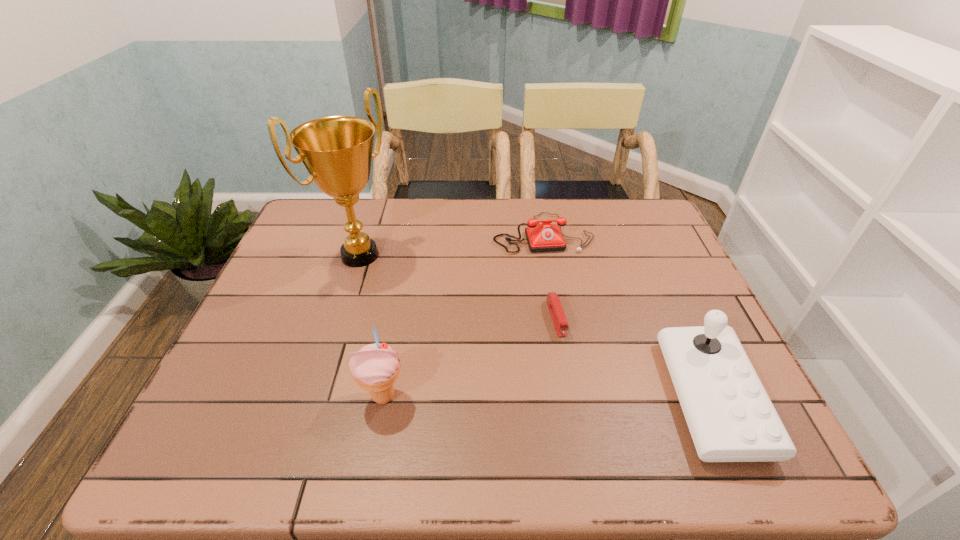
Locate an element on the screen. The image size is (960, 540). free space between the stapler and the tallest object is located at coordinates (458, 287).

Locate which object ranks second in proximity to the shortest object. Please provide its 2D coordinates. Your answer should be formatted as a tuple, i.e. [(x, y)], where the tuple contains the x and y coordinates of a point satisfying the conditions above.

[(730, 416)]

Locate an element on the screen. This screenshot has height=540, width=960. object that can be found as the closest to the third farthest object is located at coordinates (545, 237).

Identify the location of blank area in the image that satisfies the following two spatial constraints: 1. on the back side of the fourth tallest object; 2. on the right side of the tallest object. The height and width of the screenshot is (540, 960). (367, 233).

In order to click on free space that satisfies the following two spatial constraints: 1. on the back side of the second shortest object; 2. on the right side of the award in this screenshot , I will do `click(367, 233)`.

Find the location of a particular element. free space that satisfies the following two spatial constraints: 1. on the back side of the icecream; 2. on the left side of the shortest object is located at coordinates (398, 318).

The width and height of the screenshot is (960, 540). In order to click on vacant area in the image that satisfies the following two spatial constraints: 1. on the back side of the icecream; 2. on the right side of the third nearest object in this screenshot , I will do `click(398, 318)`.